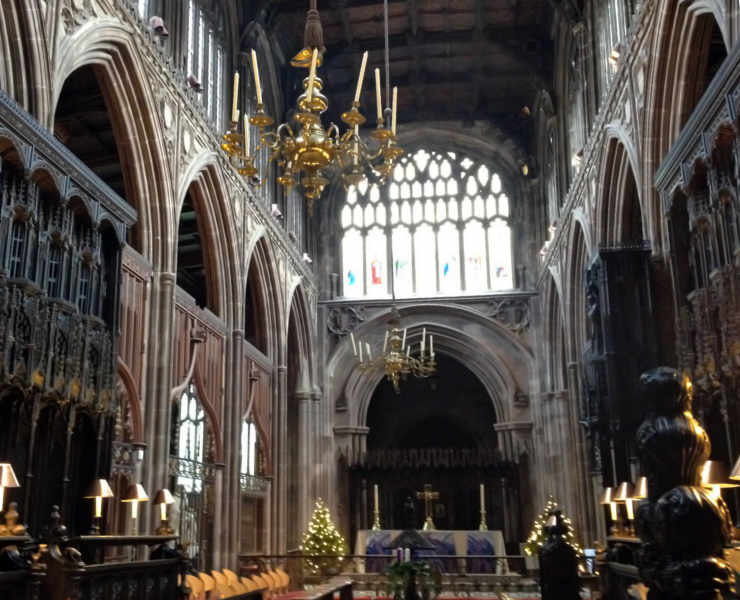
Where is `table`? table is located at coordinates (427, 538).